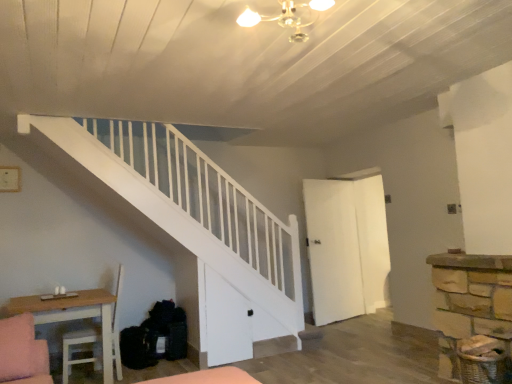
Consider the image. Measure the distance between white matte door at center-right and camera.

The distance of white matte door at center-right from camera is 16.62 feet.

Describe the element at coordinates (346, 247) in the screenshot. I see `white matte door at center-right` at that location.

At what (x,y) coordinates should I click in order to perform the action: click on white matte door at center-right. Please return your answer as a coordinate pair (x, y). The image size is (512, 384). Looking at the image, I should click on (346, 247).

Locate an element on the screen. The width and height of the screenshot is (512, 384). light wood table at lower left is located at coordinates (73, 316).

This screenshot has height=384, width=512. Describe the element at coordinates (73, 316) in the screenshot. I see `light wood table at lower left` at that location.

I want to click on white matte door at center-right, so click(346, 247).

Considering the relative positions of light wood table at lower left and white matte door at center-right in the image provided, is light wood table at lower left to the left or to the right of white matte door at center-right?

light wood table at lower left is positioned on white matte door at center-right's left side.

Which object is closer to the camera taking this photo, light wood table at lower left or white matte door at center-right?

Positioned in front is light wood table at lower left.

Which is behind, point (67, 318) or point (323, 214)?

The point (323, 214) is more distant.

From the image's perspective, is light wood table at lower left above or below white matte door at center-right?

Based on their image positions, light wood table at lower left is located beneath white matte door at center-right.

From a real-world perspective, is light wood table at lower left located higher than white matte door at center-right?

Incorrect, from a real-world perspective, light wood table at lower left is lower than white matte door at center-right.

Does light wood table at lower left have a greater width compared to white matte door at center-right?

Yes, light wood table at lower left is wider than white matte door at center-right.

Can you confirm if light wood table at lower left is taller than white matte door at center-right?

No, light wood table at lower left is not taller than white matte door at center-right.

Between light wood table at lower left and white matte door at center-right, which one has smaller size?

white matte door at center-right is smaller.

Is light wood table at lower left positioned beyond the bounds of white matte door at center-right?

Yes, light wood table at lower left is outside of white matte door at center-right.

Is light wood table at lower left next to white matte door at center-right and touching it?

light wood table at lower left and white matte door at center-right are not in contact.

Is light wood table at lower left facing towards white matte door at center-right?

Yes, light wood table at lower left faces towards white matte door at center-right.

Can you tell me how much light wood table at lower left and white matte door at center-right differ in facing direction?

light wood table at lower left and white matte door at center-right are facing 81.5 degrees away from each other.

Measure the distance between light wood table at lower left and white matte door at center-right.

light wood table at lower left is 2.95 meters from white matte door at center-right.

Find the location of a particular element. The width and height of the screenshot is (512, 384). table that appears on the left of white matte door at center-right is located at coordinates (73, 316).

Can you confirm if white matte door at center-right is positioned to the right of light wood table at lower left?

Yes, white matte door at center-right is to the right of light wood table at lower left.

Is the position of white matte door at center-right more distant than that of light wood table at lower left?

Yes, white matte door at center-right is behind light wood table at lower left.

Is point (380, 204) in front of point (106, 362)?

No.

From the image's perspective, is white matte door at center-right located above light wood table at lower left?

Indeed, from the image's perspective, white matte door at center-right is shown above light wood table at lower left.

From a real-world perspective, which object rests below the other?

light wood table at lower left, from a real-world perspective.

Is white matte door at center-right wider than light wood table at lower left?

No, white matte door at center-right is not wider than light wood table at lower left.

Considering the sizes of objects white matte door at center-right and light wood table at lower left in the image provided, who is shorter, white matte door at center-right or light wood table at lower left?

light wood table at lower left is shorter.

Based on their sizes in the image, would you say white matte door at center-right is bigger or smaller than light wood table at lower left?

Considering their sizes, white matte door at center-right takes up less space than light wood table at lower left.

Would you say light wood table at lower left is part of white matte door at center-right's contents?

Actually, light wood table at lower left is outside white matte door at center-right.

Are white matte door at center-right and light wood table at lower left far apart?

Yes, white matte door at center-right is far from light wood table at lower left.

Is white matte door at center-right facing away from light wood table at lower left?

No, light wood table at lower left is not at the back of white matte door at center-right.

How different are the orientations of white matte door at center-right and light wood table at lower left in degrees?

The facing directions of white matte door at center-right and light wood table at lower left are 81.5 degrees apart.

This screenshot has width=512, height=384. In order to click on table lying below the white matte door at center-right (from the image's perspective) in this screenshot , I will do `click(73, 316)`.

You are a GUI agent. You are given a task and a screenshot of the screen. Output one action in this format:
    pyautogui.click(x=<x>, y=<y>)
    Task: Click on the table in front of the white matte door at center-right
    The height and width of the screenshot is (384, 512).
    Given the screenshot: What is the action you would take?
    pyautogui.click(x=73, y=316)

I want to click on door behind the light wood table at lower left, so click(346, 247).